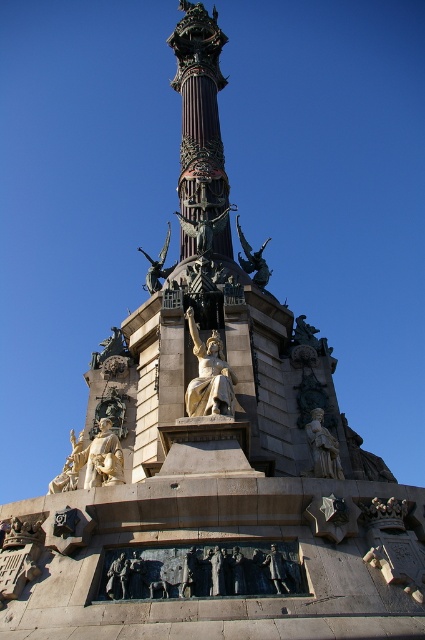
You are standing in front of the monument and want to place a new plaque on the statue that is higher up. Which statue should you choose between the gold polished statue at center and the polished bronze statue at center?

The gold polished statue at center is positioned over the polished bronze statue at center, so you should choose the gold polished statue at center since it is higher up.

You are a tourist standing in front of the monument and want to take a photo that includes both the gold polished statue at center and the bronze statue at center. Which statue should you position to your left to frame both in the photo?

The gold polished statue at center is positioned on the right side of bronze statue at center, so to frame both in the photo, you should position the bronze statue at center to your left, allowing the gold polished statue at center to be on its right side in the frame.